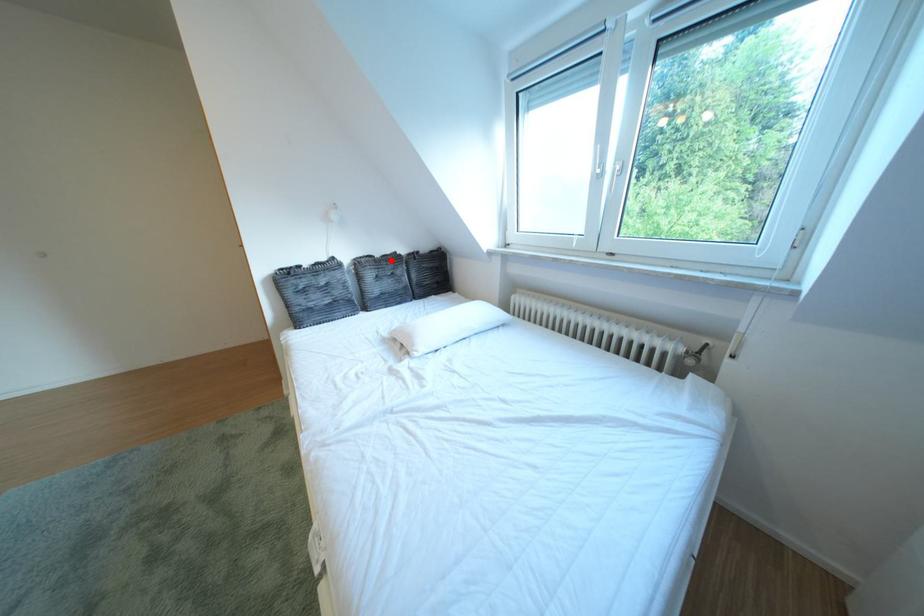
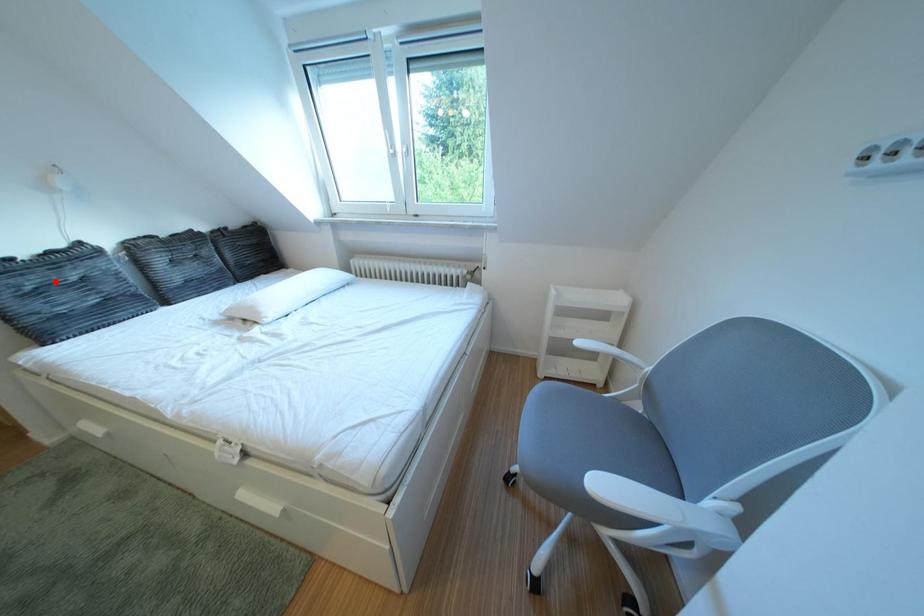
I am providing you with two images of the same scene from different viewpoints. A red point is marked on the first image and another point is marked on the second image. Does the point marked in image1 correspond to the same location as the one in image2?

No